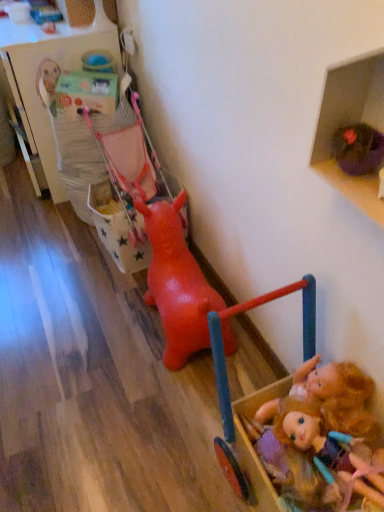
Question: Is wooden toy box at upper left, arranged as the 2th shelf when ordered from the bottom, completely or partially outside of rubber dog at center, arranged as the 2th toy when viewed from the front?

Choices:
 (A) yes
 (B) no

Answer: (A)

Question: Is wooden toy box at upper left, the second shelf viewed from the front, further to the viewer compared to rubber dog at center, which appears as the 1th toy when viewed from the back?

Choices:
 (A) no
 (B) yes

Answer: (B)

Question: Is wooden toy box at upper left, placed as the 1th shelf when sorted from back to front, smaller than rubber dog at center, arranged as the 2th toy when viewed from the front?

Choices:
 (A) no
 (B) yes

Answer: (A)

Question: From the image's perspective, is wooden toy box at upper left, placed as the 1th shelf when sorted from back to front, over rubber dog at center, which appears as the 1th toy when viewed from the back?

Choices:
 (A) yes
 (B) no

Answer: (A)

Question: Does wooden toy box at upper left, the first shelf when ordered from left to right, contain rubber dog at center, arranged as the 2th toy when viewed from the front?

Choices:
 (A) no
 (B) yes

Answer: (A)

Question: Does point (44, 77) appear closer or farther from the camera than point (306, 450)?

Choices:
 (A) closer
 (B) farther

Answer: (B)

Question: From the image's perspective, relative to wooden dollhouse at lower right, arranged as the second toy when viewed from the back, is wooden toy box at upper left, arranged as the 2th shelf when ordered from the bottom, above or below?

Choices:
 (A) below
 (B) above

Answer: (B)

Question: Considering their positions, is wooden toy box at upper left, the second shelf viewed from the front, located in front of or behind wooden dollhouse at lower right, which is the 1th toy from front to back?

Choices:
 (A) behind
 (B) front

Answer: (A)

Question: Considering the positions of wooden toy box at upper left, arranged as the 2th shelf when ordered from the bottom, and wooden dollhouse at lower right, which is the 1th toy from front to back, in the image, is wooden toy box at upper left, arranged as the 2th shelf when ordered from the bottom, wider or thinner than wooden dollhouse at lower right, which is the 1th toy from front to back,?

Choices:
 (A) wide
 (B) thin

Answer: (A)

Question: From a real-world perspective, is rubber dog at center, arranged as the 2th toy when viewed from the front, positioned above or below rubber pink baby carriage at center-left?

Choices:
 (A) below
 (B) above

Answer: (B)

Question: Considering their positions, is rubber dog at center, which appears as the 1th toy when viewed from the back, located in front of or behind rubber pink baby carriage at center-left?

Choices:
 (A) front
 (B) behind

Answer: (A)

Question: In terms of height, does rubber dog at center, arranged as the 2th toy when viewed from the front, look taller or shorter compared to rubber pink baby carriage at center-left?

Choices:
 (A) short
 (B) tall

Answer: (B)

Question: Is rubber dog at center, arranged as the 2th toy when viewed from the front, inside or outside of rubber pink baby carriage at center-left?

Choices:
 (A) outside
 (B) inside

Answer: (A)

Question: From a real-world perspective, is plush blonde doll at lower right positioned above or below rubber pink baby carriage at center-left?

Choices:
 (A) below
 (B) above

Answer: (B)

Question: Does point (327, 457) appear closer or farther from the camera than point (107, 218)?

Choices:
 (A) closer
 (B) farther

Answer: (A)